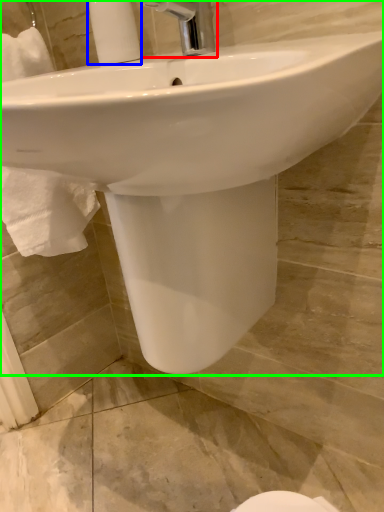
Question: Estimate the real-world distances between objects in this image. Which object is closer to tap (highlighted by a red box), soap dispenser (highlighted by a blue box) or sink (highlighted by a green box)?

Choices:
 (A) soap dispenser
 (B) sink

Answer: (A)